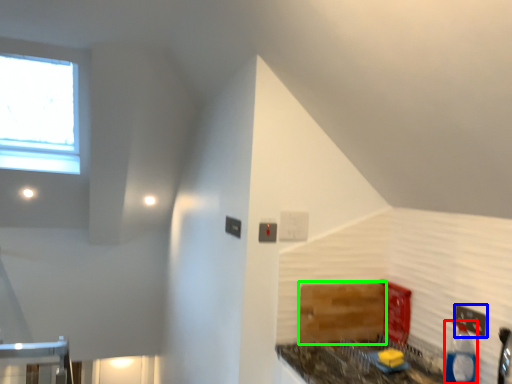
Question: Which is farther away from bottle (highlighted by a red box)? electric outlet (highlighted by a blue box) or cabinetry (highlighted by a green box)?

Choices:
 (A) electric outlet
 (B) cabinetry

Answer: (B)